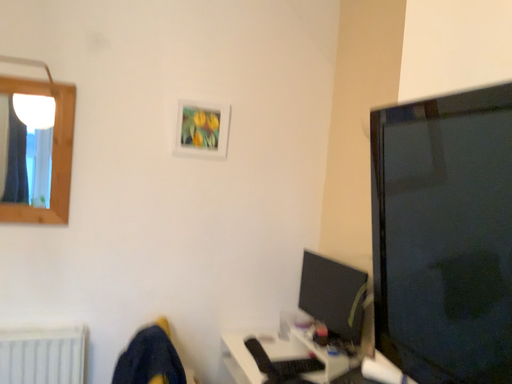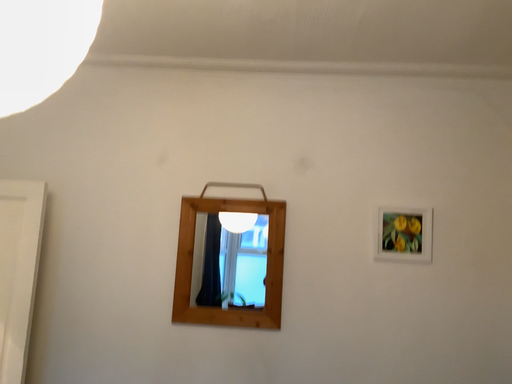
Question: Which way did the camera rotate in the video?

Choices:
 (A) rotated right
 (B) rotated left

Answer: (B)